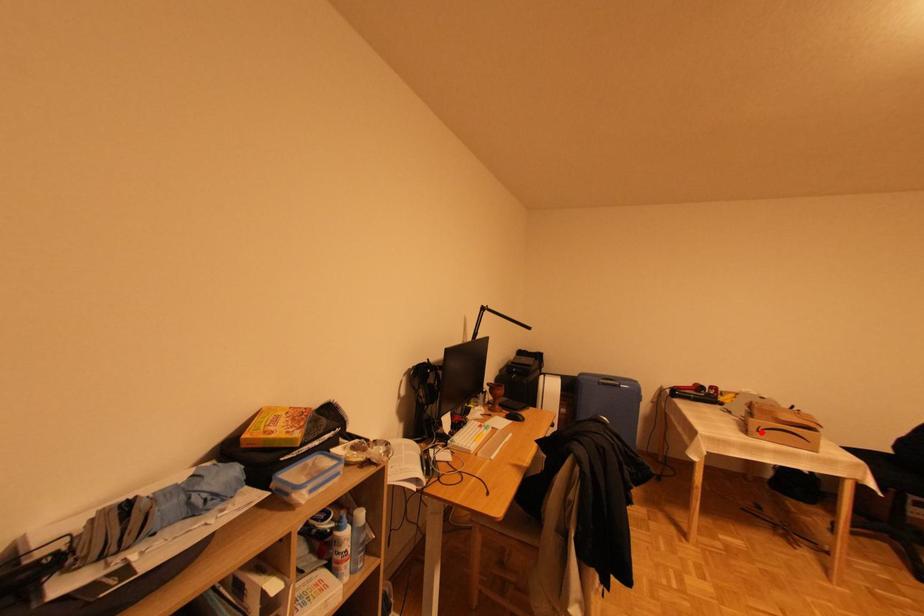
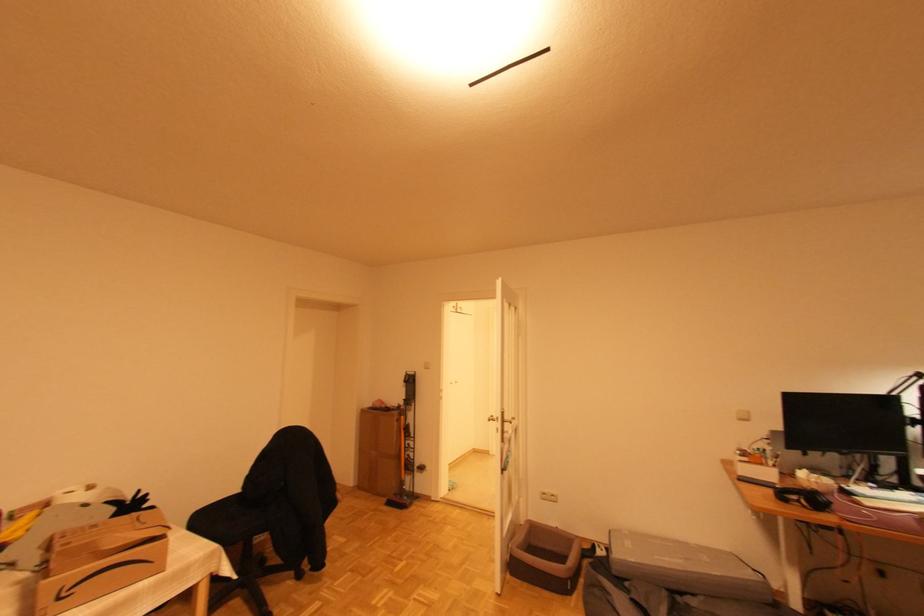
The point at the highlighted location is marked in the first image. Where is the corresponding point in the second image?

(61, 600)